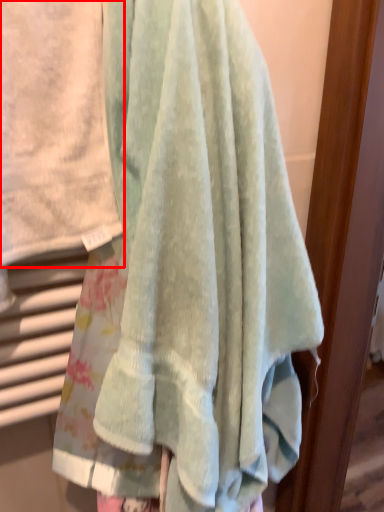
Question: From the image's perspective, what is the correct spatial relationship of towel (annotated by the red box) in relation to towel?

Choices:
 (A) below
 (B) above

Answer: (B)